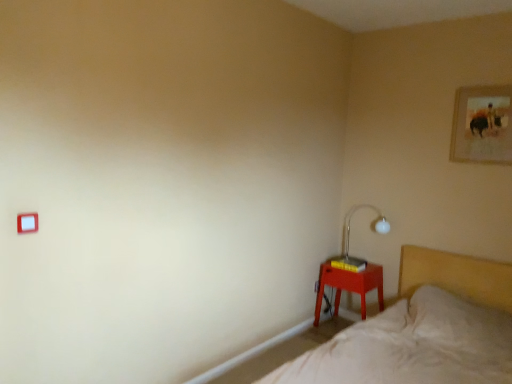
Locate an element on the screen. The width and height of the screenshot is (512, 384). vacant space situated above matte plastic nightstand at lower right (from a real-world perspective) is located at coordinates (349, 264).